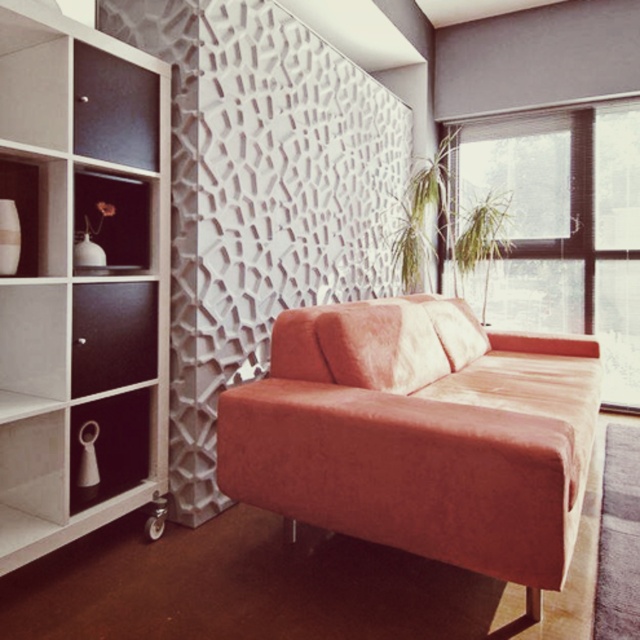
Question: Estimate the real-world distances between objects in this image. Which object is farther from the white glossy bookshelf at left?

Choices:
 (A) transparent glass window at upper right
 (B) velvet orange couch at center
 (C) white glossy vase at left

Answer: (A)

Question: Considering the real-world distances, which object is closest to the transparent glass window at upper right?

Choices:
 (A) velvet orange couch at center
 (B) white glossy bookshelf at left

Answer: (A)

Question: Does velvet orange couch at center appear on the right side of transparent glass window at upper right?

Choices:
 (A) yes
 (B) no

Answer: (B)

Question: Among these objects, which one is nearest to the camera?

Choices:
 (A) transparent glass window at upper right
 (B) white glossy bookshelf at left
 (C) velvet orange couch at center
 (D) white glossy vase at left

Answer: (C)

Question: Is velvet orange couch at center below transparent glass window at upper right?

Choices:
 (A) yes
 (B) no

Answer: (A)

Question: Is transparent glass window at upper right thinner than white glossy vase at left?

Choices:
 (A) no
 (B) yes

Answer: (A)